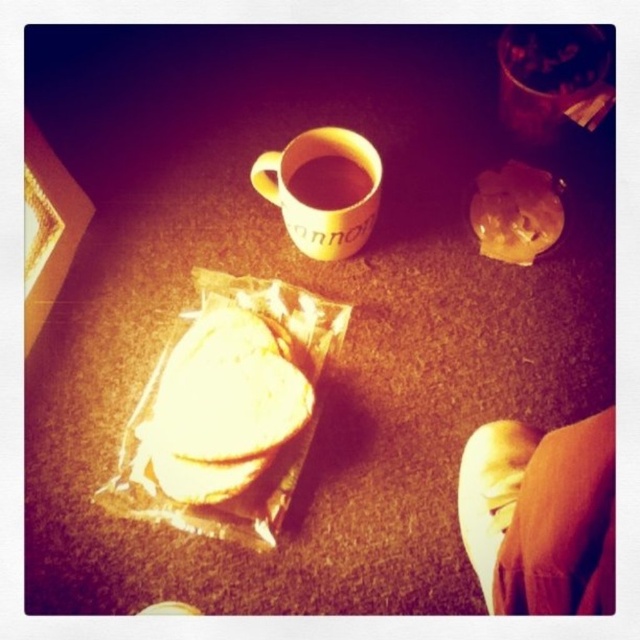
You are looking at the table from above. There are two points marked on the table surface, one at coordinates point (289, 408) and the other at point (317, 168). If you were to place a small sticker on the table, which point would require you to move your hand less to reach it first?

Point (289, 408) is closer to the viewer than point (317, 168), so you would need to move your hand less to reach point (289, 408) first.

You are a delivery person who needs to place a package on the table. The package is 10 cm wide and must be placed exactly at the coordinates given for the white paper sandwich at center. Can the package fit without overlapping any other objects on the table?

The white paper sandwich at center is located at point (221, 408). Since there are no other objects mentioned in the scene description at those coordinates, the package can be placed there without overlapping any other objects.